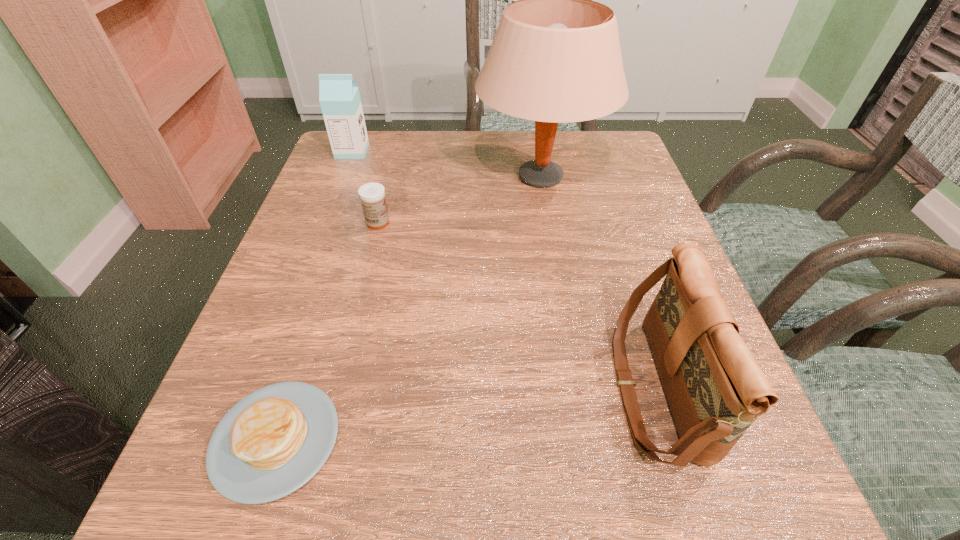
Select which object appears as the second closest to the milk carton. Please provide its 2D coordinates. Your answer should be formatted as a tuple, i.e. [(x, y)], where the tuple contains the x and y coordinates of a point satisfying the conditions above.

[(555, 58)]

I want to click on object that is the second closest to the medicine, so click(x=339, y=97).

Identify the location of free space that satisfies the following two spatial constraints: 1. on the back side of the shortest object; 2. on the right side of the medicine. The height and width of the screenshot is (540, 960). (348, 222).

Locate an element on the screen. free spot that satisfies the following two spatial constraints: 1. on the back side of the pancake; 2. on the left side of the medicine is located at coordinates (348, 222).